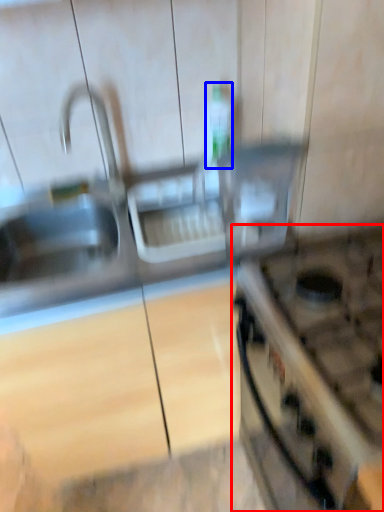
Question: Among these objects, which one is nearest to the camera, gas stove (highlighted by a red box) or bottle (highlighted by a blue box)?

Choices:
 (A) gas stove
 (B) bottle

Answer: (A)